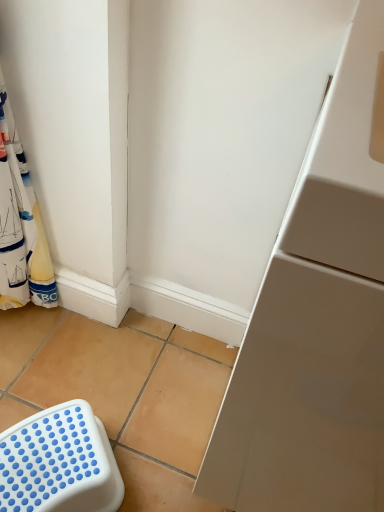
Question: Can you confirm if white plastic stool at lower left is taller than white fabric laundry at left?

Choices:
 (A) no
 (B) yes

Answer: (A)

Question: Does white plastic stool at lower left have a smaller size compared to white fabric laundry at left?

Choices:
 (A) yes
 (B) no

Answer: (A)

Question: Considering the relative sizes of white plastic stool at lower left and white fabric laundry at left in the image provided, is white plastic stool at lower left bigger than white fabric laundry at left?

Choices:
 (A) yes
 (B) no

Answer: (B)

Question: From the image's perspective, is white plastic stool at lower left beneath white fabric laundry at left?

Choices:
 (A) yes
 (B) no

Answer: (A)

Question: Does white plastic stool at lower left appear on the right side of white fabric laundry at left?

Choices:
 (A) no
 (B) yes

Answer: (B)

Question: Is white plastic stool at lower left next to white fabric laundry at left and touching it?

Choices:
 (A) no
 (B) yes

Answer: (A)

Question: Is white plastic stool at lower left surrounded by white fabric laundry at left?

Choices:
 (A) no
 (B) yes

Answer: (A)

Question: From the image's perspective, would you say white fabric laundry at left is shown under white plastic stool at lower left?

Choices:
 (A) yes
 (B) no

Answer: (B)

Question: Considering the relative sizes of white fabric laundry at left and white plastic stool at lower left in the image provided, is white fabric laundry at left shorter than white plastic stool at lower left?

Choices:
 (A) no
 (B) yes

Answer: (A)

Question: Is white fabric laundry at left oriented away from white plastic stool at lower left?

Choices:
 (A) no
 (B) yes

Answer: (A)

Question: Considering the relative positions of white fabric laundry at left and white plastic stool at lower left in the image provided, is white fabric laundry at left behind white plastic stool at lower left?

Choices:
 (A) yes
 (B) no

Answer: (B)

Question: Considering the relative positions of white fabric laundry at left and white plastic stool at lower left in the image provided, is white fabric laundry at left to the right of white plastic stool at lower left from the viewer's perspective?

Choices:
 (A) no
 (B) yes

Answer: (A)

Question: Is white plastic stool at lower left taller or shorter than white fabric laundry at left?

Choices:
 (A) tall
 (B) short

Answer: (B)